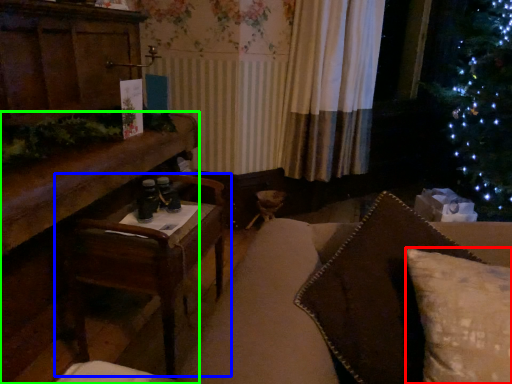
Question: Which object is positioned farthest from pillow (highlighted by a red box)? Select from table (highlighted by a blue box) and furniture (highlighted by a green box).

Choices:
 (A) table
 (B) furniture

Answer: (B)